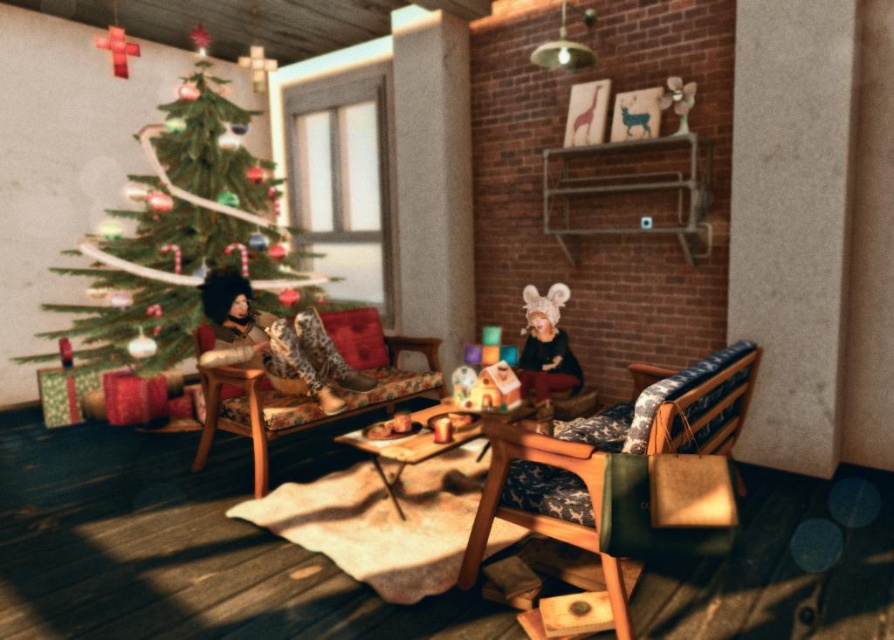
Question: Which object appears farthest from the camera in this image?

Choices:
 (A) leather boots at left
 (B) wooden textured rocking chair at lower right

Answer: (A)

Question: Does wooden armchair at left appear on the left side of leather boots at left?

Choices:
 (A) yes
 (B) no

Answer: (B)

Question: Which object appears closest to the camera in this image?

Choices:
 (A) leather boots at left
 (B) wooden textured rocking chair at lower right

Answer: (B)

Question: Which point is farther from the camera taking this photo?

Choices:
 (A) (564, 336)
 (B) (654, 410)
 (C) (276, 353)
 (D) (234, 131)

Answer: (D)

Question: Is wooden table at center smaller than matte black doll at center?

Choices:
 (A) no
 (B) yes

Answer: (A)

Question: Does leather boots at left appear over wooden table at center?

Choices:
 (A) yes
 (B) no

Answer: (A)